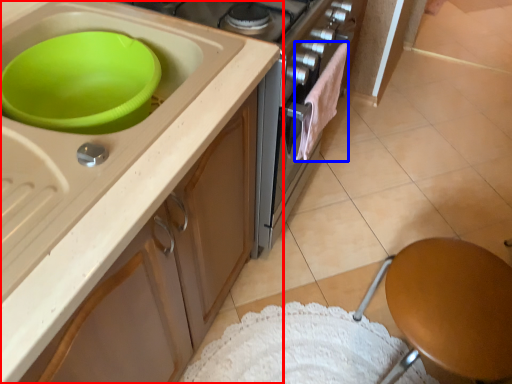
Question: Among these objects, which one is nearest to the camera, cabinetry (highlighted by a red box) or clothe (highlighted by a blue box)?

Choices:
 (A) cabinetry
 (B) clothe

Answer: (A)